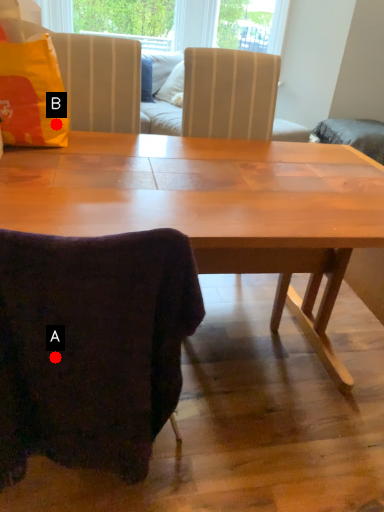
Question: Two points are circled on the image, labeled by A and B beside each circle. Which point is further to the camera?

Choices:
 (A) A is further
 (B) B is further

Answer: (B)